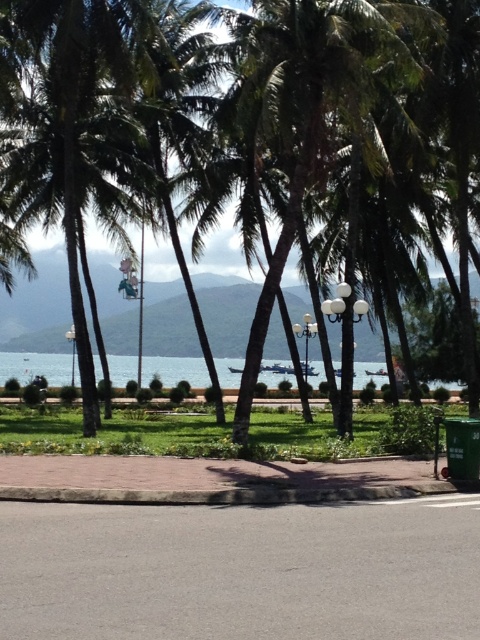
Question: Does green leafy coconut tree at center come behind clear blue water at center?

Choices:
 (A) no
 (B) yes

Answer: (A)

Question: Which point is farther from the camera taking this photo?

Choices:
 (A) (248, 61)
 (B) (179, 358)

Answer: (B)

Question: Does green leafy coconut tree at center appear on the left side of clear blue water at center?

Choices:
 (A) yes
 (B) no

Answer: (A)

Question: Is green leafy coconut tree at center to the left of clear blue water at center from the viewer's perspective?

Choices:
 (A) no
 (B) yes

Answer: (B)